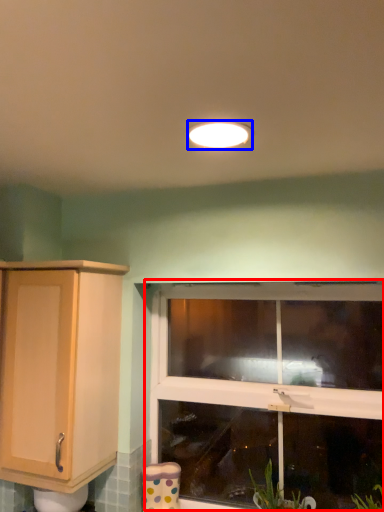
Question: Which object is further to the camera taking this photo, window (highlighted by a red box) or light fixture (highlighted by a blue box)?

Choices:
 (A) window
 (B) light fixture

Answer: (A)